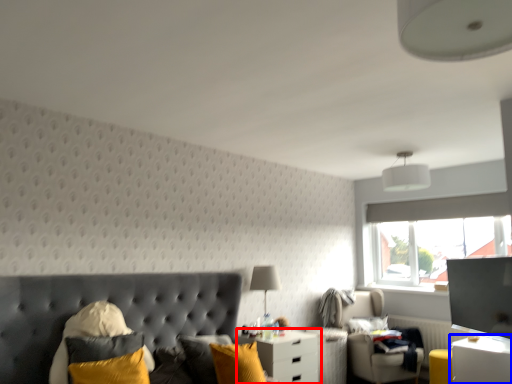
Question: Which object is closer to the camera taking this photo, nightstand (highlighted by a red box) or nightstand (highlighted by a blue box)?

Choices:
 (A) nightstand
 (B) nightstand

Answer: (B)